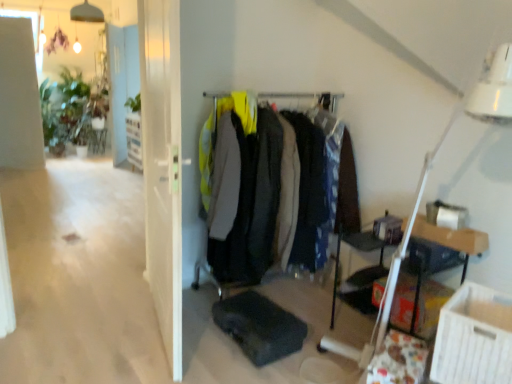
Question: Is white cardboard box at lower right taller or shorter than white glossy door at upper center?

Choices:
 (A) tall
 (B) short

Answer: (B)

Question: Considering the positions of white cardboard box at lower right and white glossy door at upper center in the image, is white cardboard box at lower right wider or thinner than white glossy door at upper center?

Choices:
 (A) wide
 (B) thin

Answer: (A)

Question: Estimate the real-world distances between objects in this image. Which object is farther from the transparent glass door at center?

Choices:
 (A) white glossy shelf at upper center
 (B) white plastic table lamp at upper right
 (C) white cardboard box at lower right
 (D) white glossy door at upper center
 (E) wooden table at right

Answer: (D)

Question: Which object is the closest to the matte black coat rack at center?

Choices:
 (A) green matte plant at upper left
 (B) transparent glass door at center
 (C) white glossy door at upper center
 (D) white plastic table lamp at upper right
 (E) wooden table at right

Answer: (B)